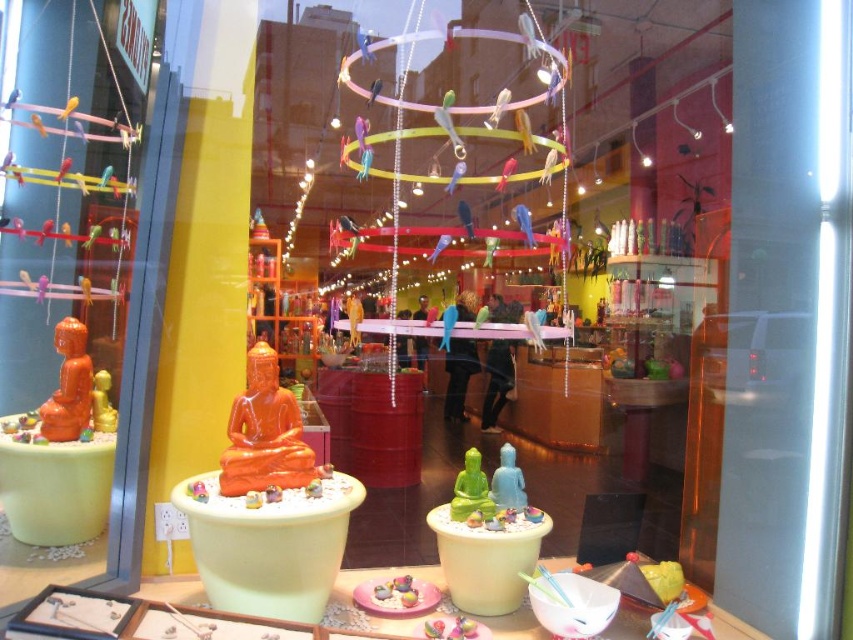
Question: Considering the relative positions of orange glossy buddha statue at center and orange matte buddha at left in the image provided, where is orange glossy buddha statue at center located with respect to orange matte buddha at left?

Choices:
 (A) right
 (B) left

Answer: (A)

Question: Is orange glossy buddha statue at center bigger than green matte buddha at center?

Choices:
 (A) yes
 (B) no

Answer: (A)

Question: Among these points, which one is nearest to the camera?

Choices:
 (A) (259, 419)
 (B) (461, 500)
 (C) (79, 381)
 (D) (94, 381)

Answer: (A)

Question: Considering the real-world distances, which object is closest to the gold matte buddha statue at center?

Choices:
 (A) matte blue buddha at center
 (B) green matte buddha at center
 (C) orange matte buddha at left

Answer: (C)

Question: Which of these objects is positioned closest to the orange matte buddha at left?

Choices:
 (A) orange glossy buddha statue at center
 (B) green matte buddha at center
 (C) gold matte buddha statue at center

Answer: (C)

Question: Can you confirm if orange glossy buddha statue at center is bigger than orange matte buddha at left?

Choices:
 (A) no
 (B) yes

Answer: (B)